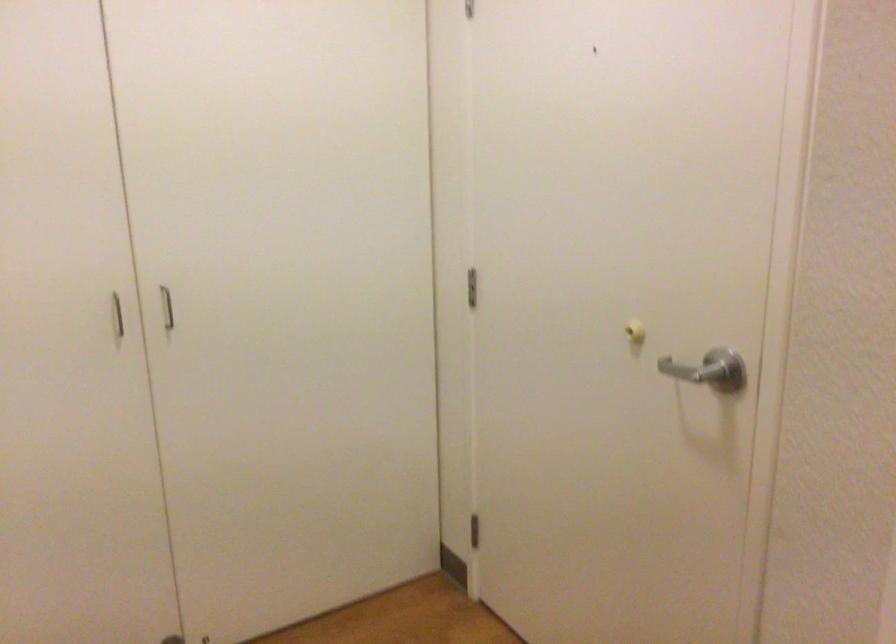
The height and width of the screenshot is (644, 896). What do you see at coordinates (692, 371) in the screenshot?
I see `the silver door handle` at bounding box center [692, 371].